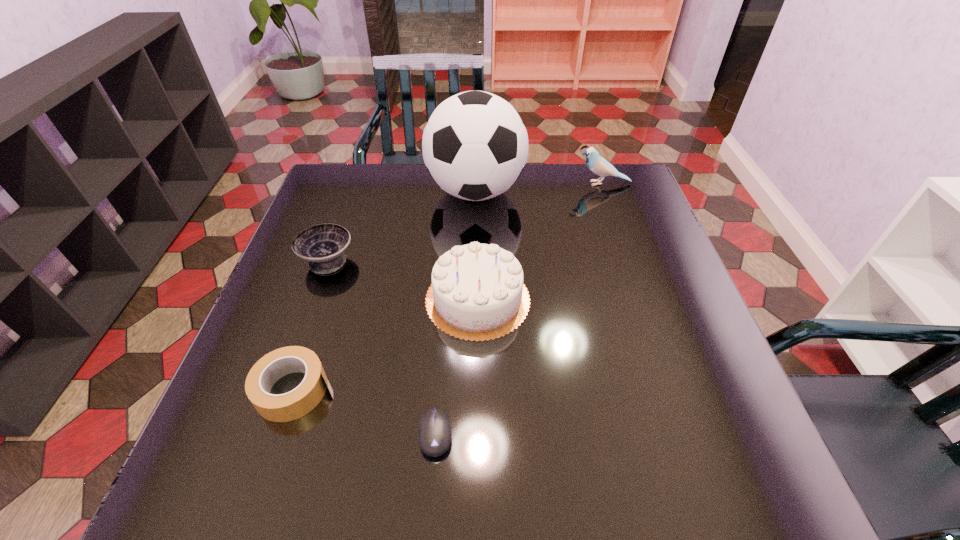
I want to click on free space in the image that satisfies the following two spatial constraints: 1. at the edge of the shortest object; 2. on the right side of the second shortest object, so (279, 434).

The height and width of the screenshot is (540, 960). I want to click on free space in the image that satisfies the following two spatial constraints: 1. on the front side of the soccer ball; 2. on the right side of the birthday cake, so point(474,299).